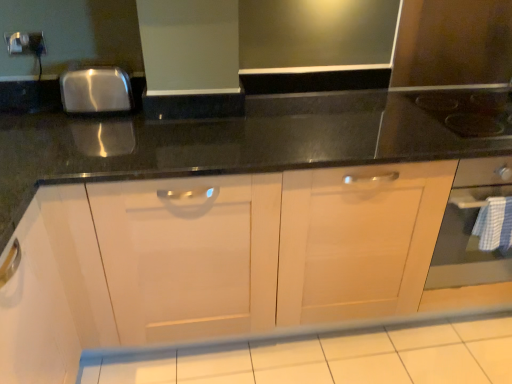
In the scene shown: Measure the distance between black glass gas stove at upper right and camera.

They are 1.48 meters apart.

In order to click on metallic silver electric outlet at upper left in this screenshot , I will do `click(25, 43)`.

From a real-world perspective, which is physically above, metallic silver electric outlet at upper left or white glossy tile at lower center?

metallic silver electric outlet at upper left, from a real-world perspective.

Identify the location of tile lying below the metallic silver electric outlet at upper left (from the image's perspective). (328, 355).

Between point (42, 34) and point (410, 342), which one is positioned behind?

The point (410, 342) is farther from the camera.

Who is bigger, white glossy tile at lower center or metallic silver electric outlet at upper left?

white glossy tile at lower center.

Can you see white glossy tile at lower center touching metallic silver electric outlet at upper left?

No, white glossy tile at lower center is not touching metallic silver electric outlet at upper left.

The width and height of the screenshot is (512, 384). In order to click on tile in front of the metallic silver electric outlet at upper left in this screenshot , I will do `click(328, 355)`.

In the scene shown: Could you tell me if white glossy tile at lower center is turned towards metallic silver electric outlet at upper left?

No, white glossy tile at lower center is not aimed at metallic silver electric outlet at upper left.

Is black glass gas stove at upper right positioned far away from metallic silver electric outlet at upper left?

Yes.

At what (x,y) coordinates should I click in order to perform the action: click on gas stove in front of the metallic silver electric outlet at upper left. Please return your answer as a coordinate pair (x, y). Image resolution: width=512 pixels, height=384 pixels. Looking at the image, I should click on (468, 110).

Could you measure the distance between black glass gas stove at upper right and metallic silver electric outlet at upper left?

A distance of 1.66 meters exists between black glass gas stove at upper right and metallic silver electric outlet at upper left.

From the image's perspective, is white glossy tile at lower center positioned above or below black glass gas stove at upper right?

Clearly, from the image's perspective, white glossy tile at lower center is below black glass gas stove at upper right.

Considering their positions, is white glossy tile at lower center located in front of or behind black glass gas stove at upper right?

Clearly, white glossy tile at lower center is in front of black glass gas stove at upper right.

Can black glass gas stove at upper right be found inside white glossy tile at lower center?

No, white glossy tile at lower center does not contain black glass gas stove at upper right.

Which of these two, white glossy tile at lower center or black glass gas stove at upper right, is thinner?

white glossy tile at lower center is thinner.

Which object is positioned more to the right, black glass gas stove at upper right or white glossy tile at lower center?

From the viewer's perspective, black glass gas stove at upper right appears more on the right side.

From a real-world perspective, which is physically above, black glass gas stove at upper right or white glossy tile at lower center?

black glass gas stove at upper right, from a real-world perspective.

Does black glass gas stove at upper right have a greater width compared to white glossy tile at lower center?

Correct, the width of black glass gas stove at upper right exceeds that of white glossy tile at lower center.

Based on the photo, is metallic silver electric outlet at upper left with black glass gas stove at upper right?

metallic silver electric outlet at upper left is not next to black glass gas stove at upper right, and they're not touching.

Which is more to the right, metallic silver electric outlet at upper left or black glass gas stove at upper right?

From the viewer's perspective, black glass gas stove at upper right appears more on the right side.

The width and height of the screenshot is (512, 384). Identify the location of electric outlet on the left of black glass gas stove at upper right. (25, 43).

Looking at this image, which of these two, metallic silver electric outlet at upper left or black glass gas stove at upper right, is smaller?

With smaller size is metallic silver electric outlet at upper left.

This screenshot has height=384, width=512. There is a white glossy tile at lower center. Identify the location of electric outlet above it (from a real-world perspective). (25, 43).

The height and width of the screenshot is (384, 512). Find the location of `electric outlet that is behind the white glossy tile at lower center`. electric outlet that is behind the white glossy tile at lower center is located at coordinates (25, 43).

Looking at this image, which object lies further to the anchor point black glass gas stove at upper right, metallic silver electric outlet at upper left or white glossy tile at lower center?

Based on the image, metallic silver electric outlet at upper left appears to be further to black glass gas stove at upper right.

When comparing their distances from white glossy tile at lower center, does metallic silver electric outlet at upper left or black glass gas stove at upper right seem closer?

The object closer to white glossy tile at lower center is black glass gas stove at upper right.

In the scene shown: Considering their positions, is white glossy tile at lower center positioned further to black glass gas stove at upper right than metallic silver electric outlet at upper left?

metallic silver electric outlet at upper left is further to black glass gas stove at upper right.

Based on their spatial positions, is black glass gas stove at upper right or white glossy tile at lower center closer to metallic silver electric outlet at upper left?

white glossy tile at lower center is positioned closer to the anchor metallic silver electric outlet at upper left.

Considering their positions, is black glass gas stove at upper right positioned closer to white glossy tile at lower center than metallic silver electric outlet at upper left?

black glass gas stove at upper right lies closer to white glossy tile at lower center than the other object.

Estimate the real-world distances between objects in this image. Which object is further from metallic silver electric outlet at upper left, white glossy tile at lower center or black glass gas stove at upper right?

The object further to metallic silver electric outlet at upper left is black glass gas stove at upper right.

Locate an element on the screen. This screenshot has width=512, height=384. tile between metallic silver electric outlet at upper left and black glass gas stove at upper right from left to right is located at coordinates (328, 355).